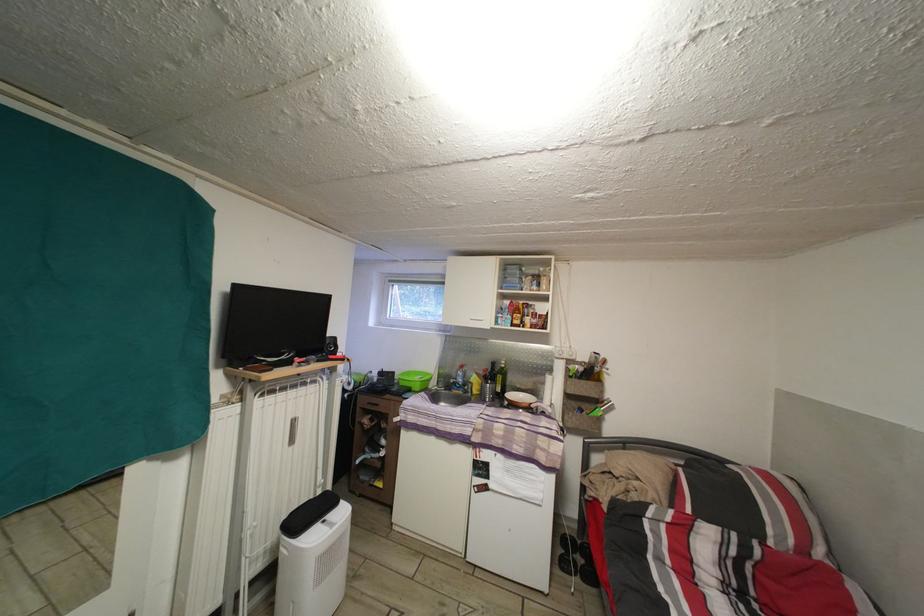
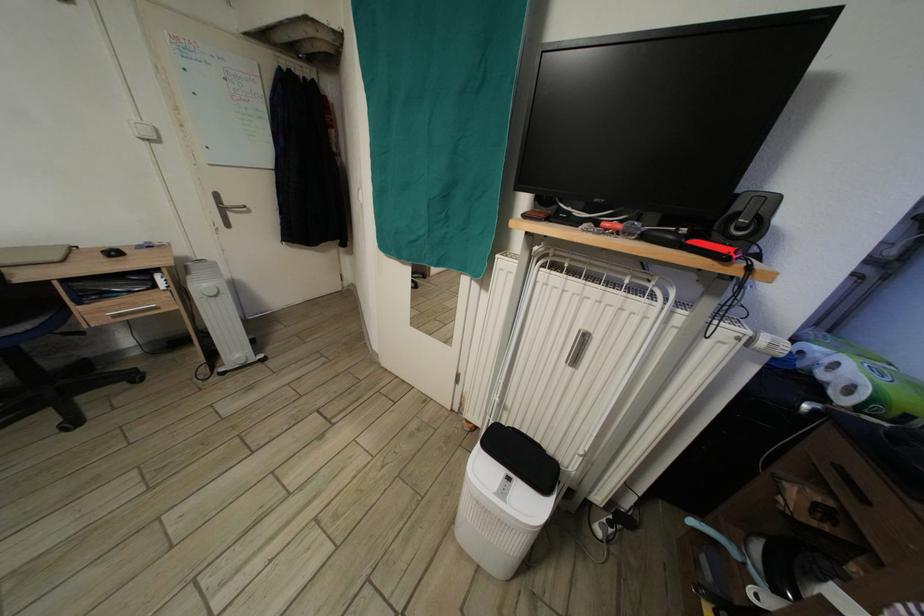
Where in the second image is the point corresponding to pixel 334 349 from the first image?

(744, 214)